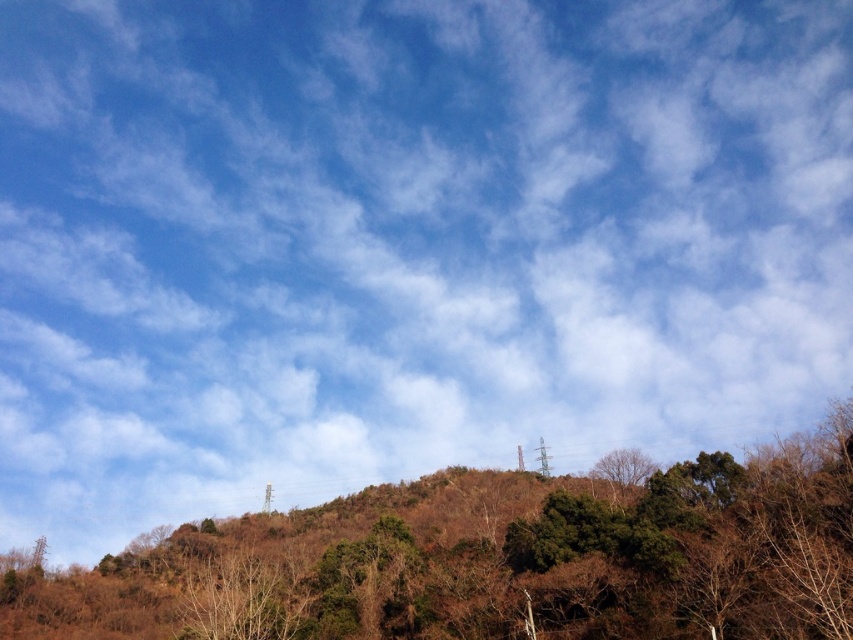
Who is shorter, brown/dry wood at center or bare branches at center?

Standing shorter between the two is bare branches at center.

Between point (392, 624) and point (640, 484), which one is positioned in front?

Point (392, 624) is in front.

Locate an element on the screen. Image resolution: width=853 pixels, height=640 pixels. brown/dry wood at center is located at coordinates (489, 560).